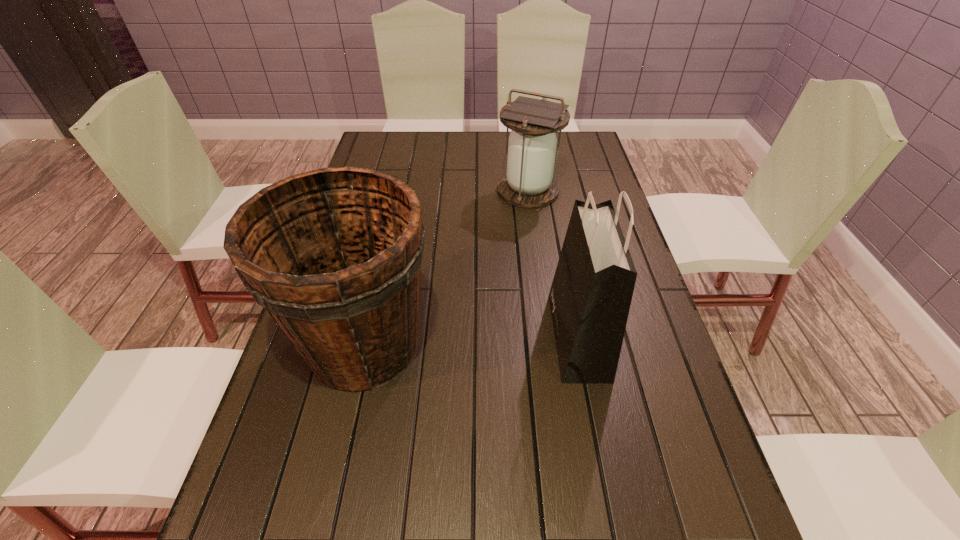
You are a GUI agent. You are given a task and a screenshot of the screen. Output one action in this format:
    pyautogui.click(x=<x>, y=<y>)
    Task: Click on the object present at the right edge
    
    Given the screenshot: What is the action you would take?
    pyautogui.click(x=591, y=293)

Image resolution: width=960 pixels, height=540 pixels. Find the location of `vacant space at the far edge`. vacant space at the far edge is located at coordinates (467, 152).

At what (x,y) coordinates should I click in order to perform the action: click on free space at the left edge. Please return your answer as a coordinate pair (x, y). The height and width of the screenshot is (540, 960). Looking at the image, I should click on (319, 384).

Where is `free location at the right edge`? This screenshot has height=540, width=960. free location at the right edge is located at coordinates (644, 531).

I want to click on free space at the far right corner of the desktop, so click(580, 137).

Locate an element on the screen. free area in between the farthest object and the bucket is located at coordinates (446, 268).

You are a GUI agent. You are given a task and a screenshot of the screen. Output one action in this format:
    pyautogui.click(x=<x>, y=<y>)
    Task: Click on the vacant space that's between the bucket and the shopping bag
    This screenshot has width=960, height=540.
    Given the screenshot: What is the action you would take?
    pyautogui.click(x=471, y=341)

Find the location of a particular element. Image resolution: width=960 pixels, height=540 pixels. vacant area between the lantern and the shopping bag is located at coordinates (553, 263).

Where is `blank region between the leftmost object and the shopping bag`? The width and height of the screenshot is (960, 540). blank region between the leftmost object and the shopping bag is located at coordinates (471, 341).

The height and width of the screenshot is (540, 960). I want to click on vacant space that's between the lantern and the bucket, so click(x=446, y=268).